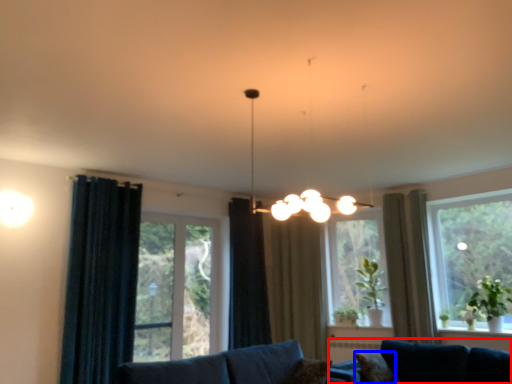
Question: Which of the following is the farthest to the observer, studio couch (highlighted by a red box) or pillow (highlighted by a blue box)?

Choices:
 (A) studio couch
 (B) pillow

Answer: (B)